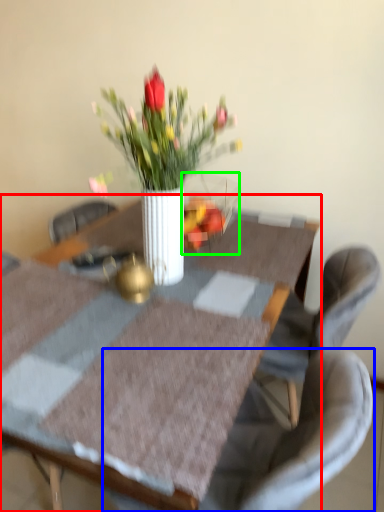
Question: Which object is positioned farthest from table (highlighted by a red box)? Select from chair (highlighted by a blue box) and glass vase (highlighted by a green box).

Choices:
 (A) chair
 (B) glass vase

Answer: (A)